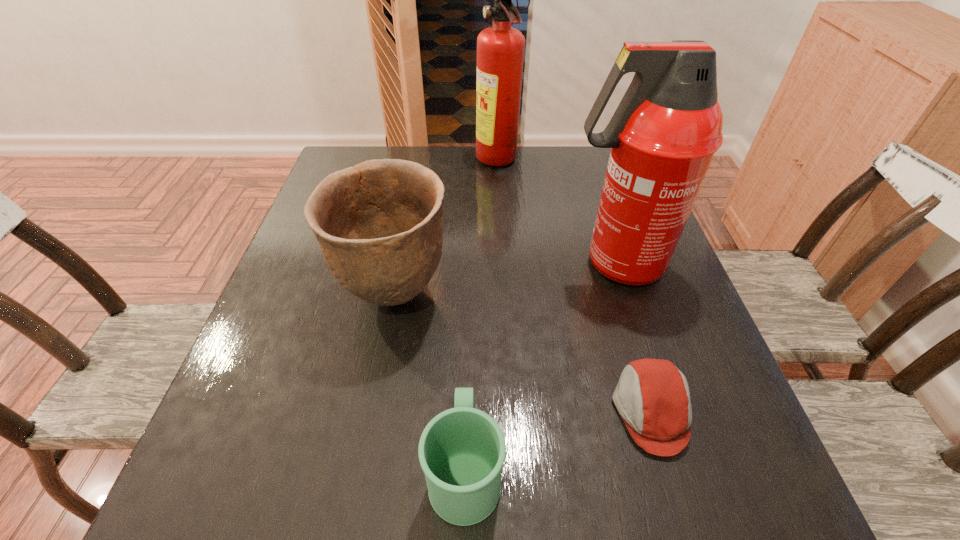
Image resolution: width=960 pixels, height=540 pixels. I want to click on the left fire extinguisher, so click(500, 49).

Find the location of a particular element. Image resolution: width=960 pixels, height=540 pixels. the farther fire extinguisher is located at coordinates (500, 49).

You are a GUI agent. You are given a task and a screenshot of the screen. Output one action in this format:
    pyautogui.click(x=<x>, y=<y>)
    Task: Click on the right fire extinguisher
    The image size is (960, 540).
    Given the screenshot: What is the action you would take?
    pyautogui.click(x=663, y=135)

Where is `pottery`? Image resolution: width=960 pixels, height=540 pixels. pottery is located at coordinates (379, 224).

At what (x,y) coordinates should I click in order to perform the action: click on mug. Please return your answer as a coordinate pair (x, y). The image size is (960, 540). Looking at the image, I should click on (462, 450).

Where is `the shortest object`? This screenshot has height=540, width=960. the shortest object is located at coordinates (652, 396).

In order to click on vacant space positioned 0.320m on the front-facing side of the left fire extinguisher in this screenshot , I will do pyautogui.click(x=367, y=162).

I want to click on free space located 0.300m on the front-facing side of the left fire extinguisher, so click(373, 162).

You are a GUI agent. You are given a task and a screenshot of the screen. Output one action in this format:
    pyautogui.click(x=<x>, y=<y>)
    Task: Click on the vacant space located 0.340m on the front-facing side of the left fire extinguisher
    Image resolution: width=960 pixels, height=540 pixels.
    Given the screenshot: What is the action you would take?
    pyautogui.click(x=359, y=162)

You are a GUI agent. You are given a task and a screenshot of the screen. Output one action in this format:
    pyautogui.click(x=<x>, y=<y>)
    Task: Click on the free space located on the trigger side of the right fire extinguisher
    This screenshot has height=540, width=960.
    Given the screenshot: What is the action you would take?
    pyautogui.click(x=446, y=264)